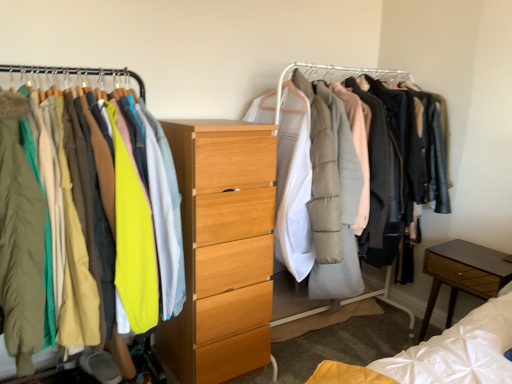
Question: Which is correct: brown wood nightstand at lower right is inside light wood chest of drawers at center, or outside of it?

Choices:
 (A) outside
 (B) inside

Answer: (A)

Question: In the image, is brown wood nightstand at lower right on the left side or the right side of light wood chest of drawers at center?

Choices:
 (A) right
 (B) left

Answer: (A)

Question: Which is farther from the light wood chest of drawers at center?

Choices:
 (A) brown wood nightstand at lower right
 (B) matte yellow jacket at left, the 3th clothing in the front-to-back sequence
 (C) matte green coat at left, the 3th clothing when ordered from back to front
 (D) matte yellow jacket at left, placed as the second clothing when sorted from front to back
 (E) matte white coat rack at center

Answer: (A)

Question: Estimate the real-world distances between objects in this image. Which object is farther from the matte yellow jacket at left, placed as the second clothing when sorted from front to back?

Choices:
 (A) matte white coat rack at center
 (B) brown wood nightstand at lower right
 (C) light wood chest of drawers at center
 (D) matte green coat at left, the 1th clothing positioned from the front
 (E) matte yellow jacket at left, the 3th clothing in the front-to-back sequence

Answer: (B)